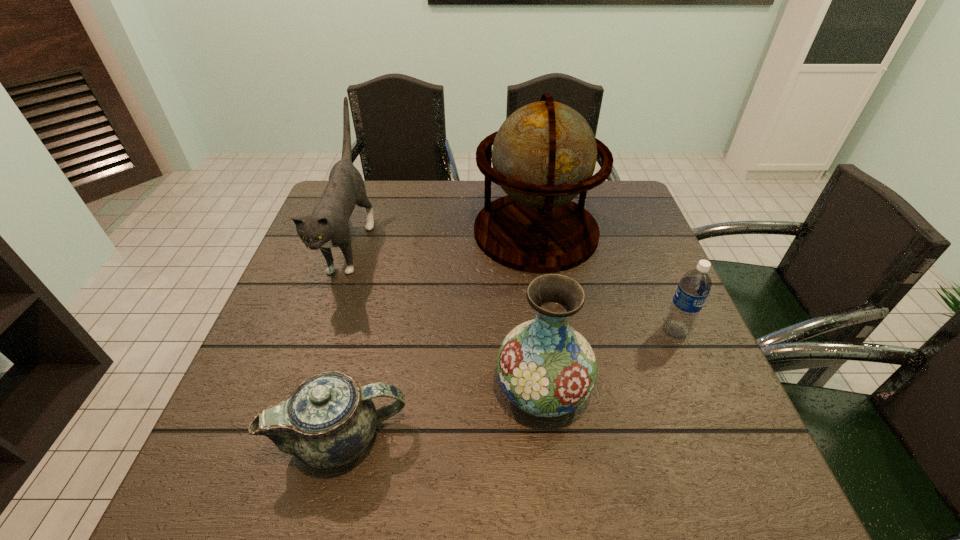
Where is `vacant region located 0.130m from the spout of the shortest object`? The width and height of the screenshot is (960, 540). vacant region located 0.130m from the spout of the shortest object is located at coordinates (477, 437).

Where is `globe that is positioned at the far edge`? Image resolution: width=960 pixels, height=540 pixels. globe that is positioned at the far edge is located at coordinates (544, 154).

Locate an element on the screen. This screenshot has width=960, height=540. cat that is positioned at the far edge is located at coordinates (328, 226).

Where is `object situated at the near edge`? This screenshot has height=540, width=960. object situated at the near edge is located at coordinates (329, 420).

Image resolution: width=960 pixels, height=540 pixels. Find the location of `cat that is at the left edge`. cat that is at the left edge is located at coordinates (328, 226).

Locate an element on the screen. chinaware located at the left edge is located at coordinates (329, 420).

This screenshot has width=960, height=540. I want to click on globe positioned at the right edge, so click(x=544, y=154).

Locate an element on the screen. The height and width of the screenshot is (540, 960). water bottle that is at the right edge is located at coordinates (694, 287).

Locate an element on the screen. object located in the far left corner section of the desktop is located at coordinates (328, 226).

This screenshot has height=540, width=960. What are the coordinates of `object present at the near left corner` in the screenshot? It's located at (329, 420).